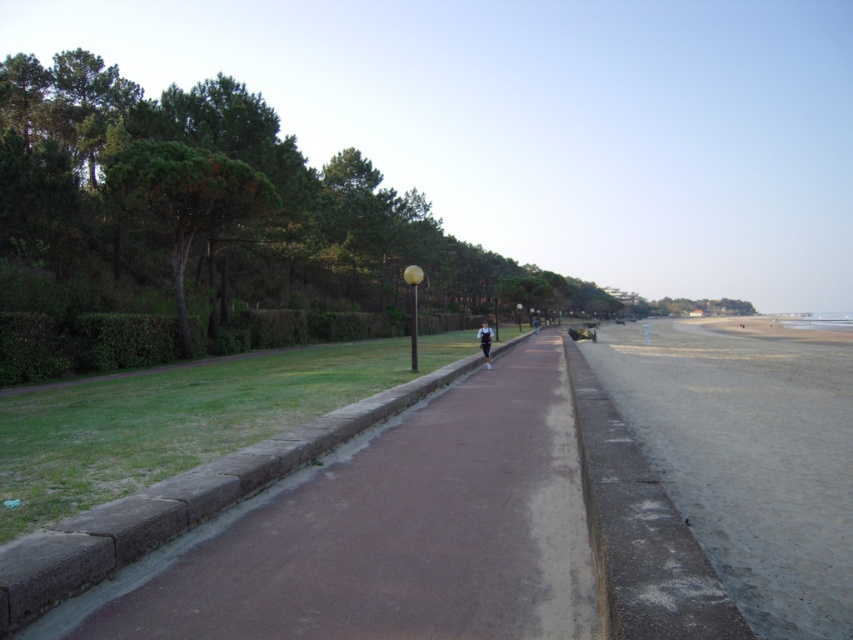
Question: Is gray sand at lower right positioned before gray concrete curb at center?

Choices:
 (A) no
 (B) yes

Answer: (A)

Question: Which point is closer to the camera?

Choices:
 (A) gray concrete curb at center
 (B) gray sand at lower right

Answer: (A)

Question: Estimate the real-world distances between objects in this image. Which object is closer to the light blue fabric jacket at center?

Choices:
 (A) gray concrete curb at center
 (B) gray sand at lower right

Answer: (A)

Question: Can you confirm if gray sand at lower right is wider than light blue fabric jacket at center?

Choices:
 (A) yes
 (B) no

Answer: (A)

Question: Does gray concrete curb at center have a larger size compared to light blue fabric jacket at center?

Choices:
 (A) yes
 (B) no

Answer: (B)

Question: Which of the following is the closest to the observer?

Choices:
 (A) gray concrete curb at center
 (B) light blue fabric jacket at center
 (C) gray sand at lower right

Answer: (A)